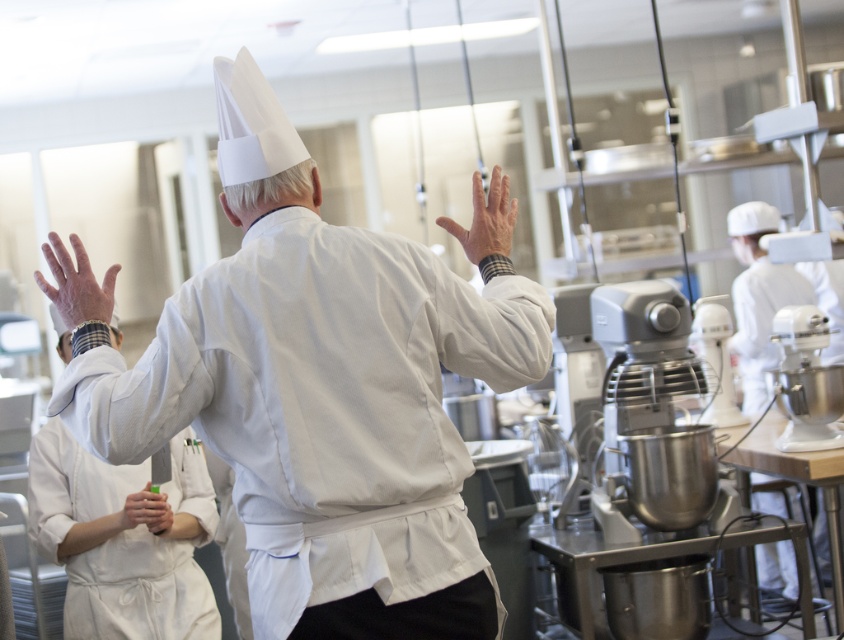
Looking at this image, does white plastic mixer at center-right appear under matte green bottle at lower left?

Incorrect, white plastic mixer at center-right is not positioned below matte green bottle at lower left.

Does white plastic mixer at center-right appear on the left side of matte green bottle at lower left?

No, white plastic mixer at center-right is not to the left of matte green bottle at lower left.

The image size is (844, 640). I want to click on white plastic mixer at center-right, so click(x=715, y=358).

Can you confirm if white paper exhaust hood at upper center is bigger than smooth white hand at center?

Incorrect, white paper exhaust hood at upper center is not larger than smooth white hand at center.

Who is shorter, white paper exhaust hood at upper center or smooth white hand at center?

Standing shorter between the two is white paper exhaust hood at upper center.

Based on the photo, who is more distant from viewer, (x=264, y=150) or (x=479, y=211)?

The point (x=479, y=211) is behind.

The image size is (844, 640). Identify the location of white paper exhaust hood at upper center. (250, 124).

Between point (219, 112) and point (796, 410), which one is positioned behind?

Point (796, 410)

Is point (231, 118) positioned after point (775, 392)?

No, (231, 118) is in front of (775, 392).

Is point (255, 134) positioned behind point (803, 397)?

No, (255, 134) is in front of (803, 397).

Identify the location of white paper exhaust hood at upper center. (250, 124).